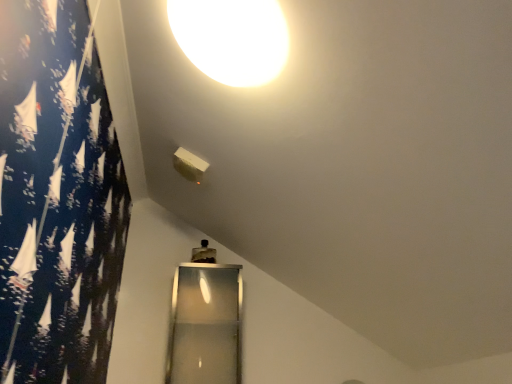
The height and width of the screenshot is (384, 512). What do you see at coordinates (205, 325) in the screenshot?
I see `transparent glass door at lower center` at bounding box center [205, 325].

Where is `transparent glass door at lower center`? The height and width of the screenshot is (384, 512). transparent glass door at lower center is located at coordinates (205, 325).

Describe the element at coordinates (232, 38) in the screenshot. The height and width of the screenshot is (384, 512). I see `white glossy lampshade at upper center` at that location.

The height and width of the screenshot is (384, 512). In order to click on white glossy lampshade at upper center in this screenshot , I will do `click(232, 38)`.

Where is `transparent glass door at lower center`? Image resolution: width=512 pixels, height=384 pixels. transparent glass door at lower center is located at coordinates (205, 325).

Consider the image. Which object is positioned more to the left, transparent glass door at lower center or white glossy lampshade at upper center?

Positioned to the left is transparent glass door at lower center.

Is transparent glass door at lower center in front of white glossy lampshade at upper center?

No, transparent glass door at lower center is further to the viewer.

Is point (203, 375) closer to viewer compared to point (267, 32)?

No, (203, 375) is behind (267, 32).

From the image's perspective, would you say transparent glass door at lower center is positioned over white glossy lampshade at upper center?

No.

From a real-world perspective, is transparent glass door at lower center over white glossy lampshade at upper center?

No.

Considering the relative sizes of transparent glass door at lower center and white glossy lampshade at upper center in the image provided, is transparent glass door at lower center thinner than white glossy lampshade at upper center?

Indeed, transparent glass door at lower center has a lesser width compared to white glossy lampshade at upper center.

Based on the photo, which of these two, transparent glass door at lower center or white glossy lampshade at upper center, stands taller?

transparent glass door at lower center is taller.

From the picture: Can you confirm if transparent glass door at lower center is bigger than white glossy lampshade at upper center?

Yes, transparent glass door at lower center is bigger than white glossy lampshade at upper center.

Consider the image. Is transparent glass door at lower center surrounding white glossy lampshade at upper center?

No, white glossy lampshade at upper center is not surrounded by transparent glass door at lower center.

Are transparent glass door at lower center and white glossy lampshade at upper center beside each other?

No.

Is transparent glass door at lower center turned away from white glossy lampshade at upper center?

No.

Find the location of `glass door located on the left of white glossy lampshade at upper center`. glass door located on the left of white glossy lampshade at upper center is located at coordinates (205, 325).

Does white glossy lampshade at upper center appear on the left side of transparent glass door at lower center?

No.

In the image, is white glossy lampshade at upper center positioned in front of or behind transparent glass door at lower center?

white glossy lampshade at upper center is positioned closer to the viewer than transparent glass door at lower center.

Between point (255, 67) and point (220, 277), which one is positioned in front?

Point (255, 67)

In the scene shown: From the image's perspective, which one is positioned higher, white glossy lampshade at upper center or transparent glass door at lower center?

From the image's view, white glossy lampshade at upper center is above.

From a real-world perspective, which object stands above the other?

In real-world perspective, white glossy lampshade at upper center is above.

Between white glossy lampshade at upper center and transparent glass door at lower center, which one has larger width?

white glossy lampshade at upper center is wider.

Which of these two, white glossy lampshade at upper center or transparent glass door at lower center, stands taller?

With more height is transparent glass door at lower center.

Considering the relative sizes of white glossy lampshade at upper center and transparent glass door at lower center in the image provided, is white glossy lampshade at upper center bigger than transparent glass door at lower center?

Actually, white glossy lampshade at upper center might be smaller than transparent glass door at lower center.

Is white glossy lampshade at upper center surrounding transparent glass door at lower center?

Actually, transparent glass door at lower center is outside white glossy lampshade at upper center.

Is white glossy lampshade at upper center next to transparent glass door at lower center and touching it?

No, white glossy lampshade at upper center is not beside transparent glass door at lower center.

Is transparent glass door at lower center at the back of white glossy lampshade at upper center?

No.

Where is `lamp on the right of the transparent glass door at lower center`? This screenshot has width=512, height=384. lamp on the right of the transparent glass door at lower center is located at coordinates (232, 38).

In the image, there is a white glossy lampshade at upper center. Where is `glass door below it (from the image's perspective)`? This screenshot has width=512, height=384. glass door below it (from the image's perspective) is located at coordinates (205, 325).

The image size is (512, 384). Find the location of `glass door on the left of the white glossy lampshade at upper center`. glass door on the left of the white glossy lampshade at upper center is located at coordinates (205, 325).